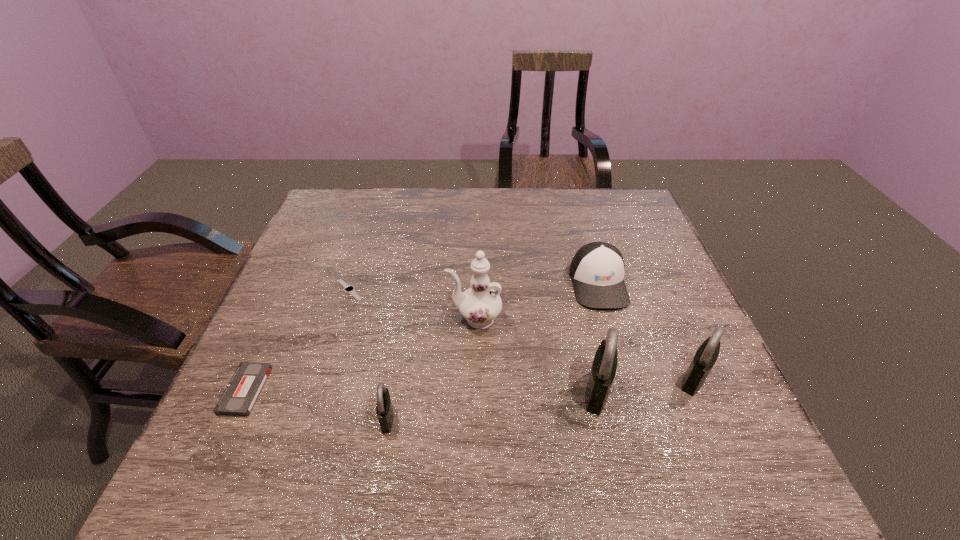
At what (x,y) coordinates should I click in order to perform the action: click on the fifth object from right to left. Please return your answer as a coordinate pair (x, y). Image resolution: width=960 pixels, height=540 pixels. Looking at the image, I should click on (384, 409).

Where is `the shortest padlock`? the shortest padlock is located at coordinates (384, 409).

What are the coordinates of `the second padlock from right to left` in the screenshot? It's located at (604, 366).

The width and height of the screenshot is (960, 540). I want to click on the fifth shortest object, so click(706, 355).

Where is `the rightmost padlock`? The width and height of the screenshot is (960, 540). the rightmost padlock is located at coordinates (706, 355).

Where is `the shortest object`? the shortest object is located at coordinates (349, 289).

The height and width of the screenshot is (540, 960). What are the coordinates of `watch` in the screenshot? It's located at (349, 289).

Where is `the tallest object`? The width and height of the screenshot is (960, 540). the tallest object is located at coordinates (480, 305).

This screenshot has width=960, height=540. I want to click on chinaware, so click(480, 305).

Identify the location of cap. The image size is (960, 540). (597, 270).